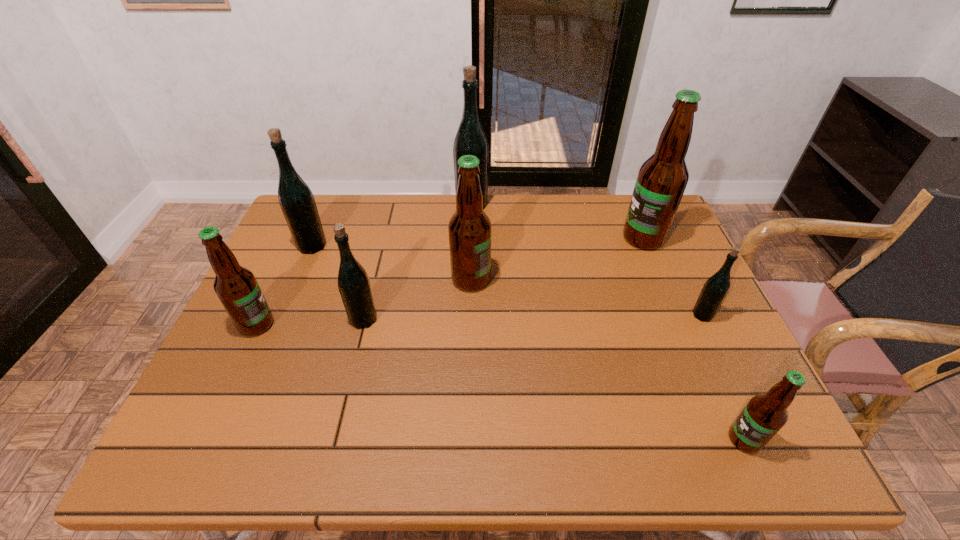
Where is `the biggest green beer bottle`? the biggest green beer bottle is located at coordinates (470, 139).

This screenshot has height=540, width=960. Identify the location of the third green beer bottle from left to right. (470, 139).

Where is `the biggest brown beer bottle`? the biggest brown beer bottle is located at coordinates (661, 181).

Identify the location of the leftmost green beer bottle. (296, 200).

The height and width of the screenshot is (540, 960). I want to click on the third smallest green beer bottle, so pos(296,200).

This screenshot has width=960, height=540. Find the location of `the second biggest brown beer bottle`. the second biggest brown beer bottle is located at coordinates (469, 228).

Find the location of a particular element. This screenshot has height=540, width=960. the third brown beer bottle from right to left is located at coordinates (469, 228).

Where is `the second nearest brown beer bottle`? This screenshot has width=960, height=540. the second nearest brown beer bottle is located at coordinates (236, 286).

The image size is (960, 540). I want to click on the third biggest brown beer bottle, so click(236, 286).

You are a GUI agent. You are given a task and a screenshot of the screen. Output one action in this format:
    pyautogui.click(x=<x>, y=<y>)
    Task: Click on the third beer bottle from left to right
    
    Given the screenshot: What is the action you would take?
    pyautogui.click(x=353, y=282)